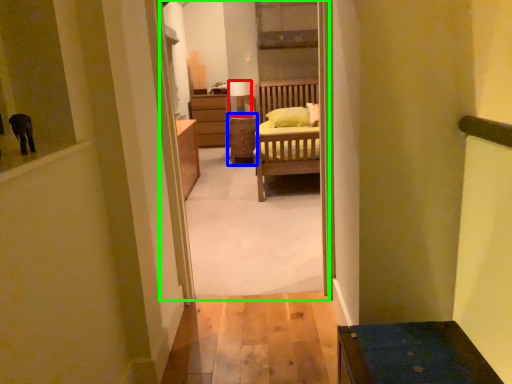
Question: Estimate the real-world distances between objects in this image. Which object is farther from lamp (highlighted by a red box), table (highlighted by a blue box) or corridor (highlighted by a green box)?

Choices:
 (A) table
 (B) corridor

Answer: (B)